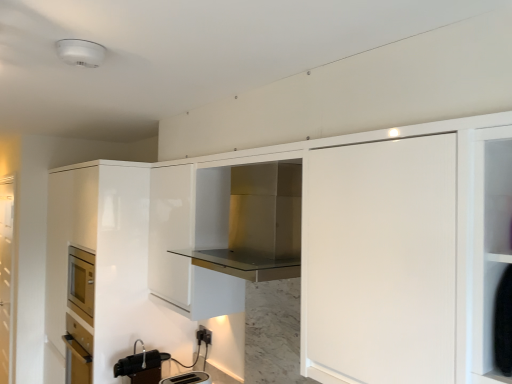
Question: From the image's perspective, is black plastic electric outlet at lower center located above or below glossy white cabinet at left, positioned as the 1th cabinetry in left-to-right order?

Choices:
 (A) above
 (B) below

Answer: (B)

Question: Based on their sizes in the image, would you say black plastic electric outlet at lower center is bigger or smaller than glossy white cabinet at left, acting as the 2th cabinetry starting from the right?

Choices:
 (A) small
 (B) big

Answer: (A)

Question: Estimate the real-world distances between objects in this image. Which object is farther from the glossy white cabinet at left, which ranks as the first cabinetry in back-to-front order?

Choices:
 (A) matte black toaster at lower center, arranged as the 2th appliance when viewed from the left
 (B) translucent glass screen door at left
 (C) stainless steel range hood at center, the 2th cabinetry viewed from the back
 (D) black plastic electric outlet at lower center
 (E) metallic silver faucet at lower center, placed as the 1th appliance when sorted from left to right

Answer: (C)

Question: Estimate the real-world distances between objects in this image. Which object is farther from the black plastic electric outlet at lower center?

Choices:
 (A) glossy white cabinet at left, the 2th cabinetry positioned from the front
 (B) matte black toaster at lower center, acting as the first appliance starting from the right
 (C) metallic silver faucet at lower center, marked as the 2th appliance in a right-to-left arrangement
 (D) stainless steel range hood at center, which is the first cabinetry in front-to-back order
 (E) translucent glass screen door at left

Answer: (E)